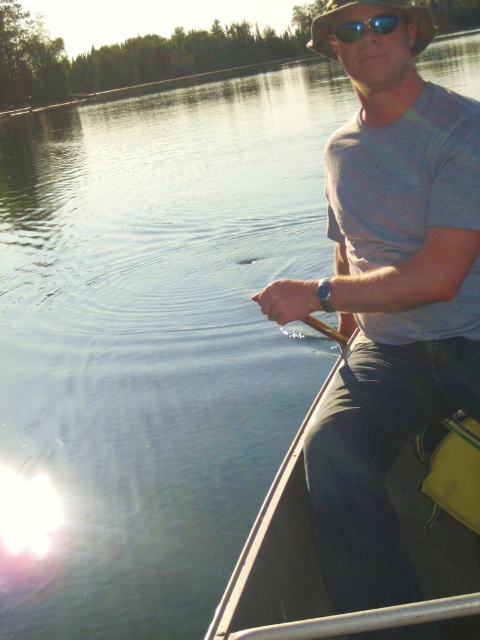
Question: Which point is closer to the camera?

Choices:
 (A) blue reflective lens sunglasses at upper center
 (B) smooth gray canoe at right

Answer: (B)

Question: Is gray cotton t-shirt at upper right wider than smooth gray canoe at right?

Choices:
 (A) yes
 (B) no

Answer: (A)

Question: Is gray cotton t-shirt at upper right closer to camera compared to smooth gray canoe at right?

Choices:
 (A) no
 (B) yes

Answer: (B)

Question: Which point is farther to the camera?

Choices:
 (A) blue reflective lens sunglasses at upper center
 (B) smooth gray canoe at right

Answer: (A)

Question: Does gray cotton t-shirt at upper right lie behind smooth gray canoe at right?

Choices:
 (A) no
 (B) yes

Answer: (A)

Question: Which point appears closest to the camera in this image?

Choices:
 (A) (394, 12)
 (B) (361, 204)

Answer: (A)